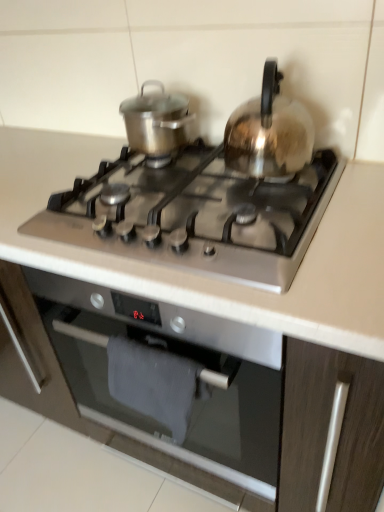
Question: From the image's perspective, relative to shiny metallic pot at upper left, the 2th kitchen appliance from the right, is satin silver oven at center above or below?

Choices:
 (A) below
 (B) above

Answer: (A)

Question: From a real-world perspective, is satin silver oven at center positioned above or below shiny metallic pot at upper left, the 2th kitchen appliance from the right?

Choices:
 (A) below
 (B) above

Answer: (A)

Question: Which of these objects is positioned farthest from the shiny metallic pot at upper left, the 1th kitchen appliance viewed from the left?

Choices:
 (A) satin silver oven at center
 (B) satin silver gas stove at center
 (C) satin silver kettle at upper right, positioned as the second kitchen appliance in left-to-right order

Answer: (A)

Question: Which object is the closest to the shiny metallic pot at upper left, the 2th kitchen appliance from the right?

Choices:
 (A) satin silver gas stove at center
 (B) satin silver oven at center
 (C) satin silver kettle at upper right, the first kitchen appliance viewed from the right

Answer: (C)